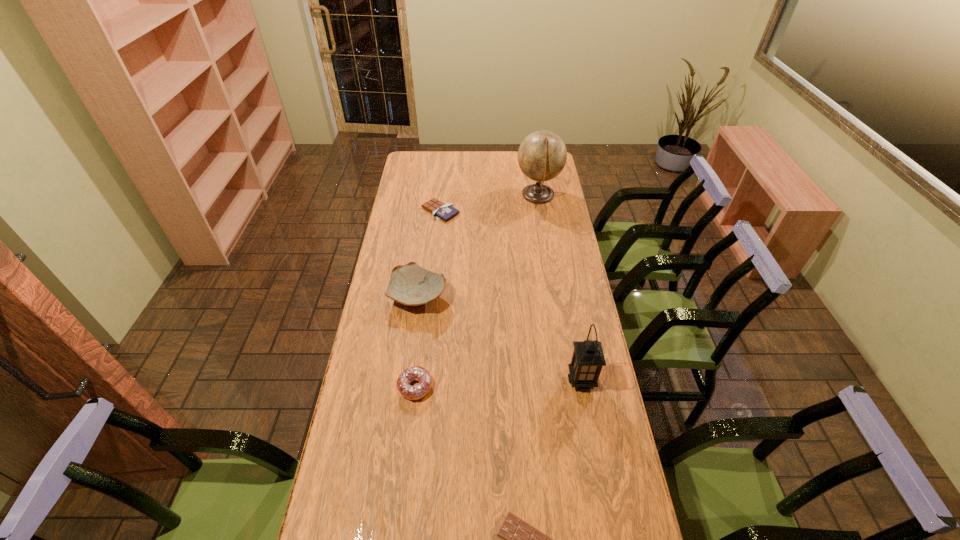
At what (x,y) coordinates should I click in order to perform the action: click on globe. Please return your answer as a coordinate pair (x, y). Image resolution: width=960 pixels, height=540 pixels. Looking at the image, I should click on (542, 155).

The height and width of the screenshot is (540, 960). In order to click on the second tallest object in this screenshot , I will do `click(588, 358)`.

Image resolution: width=960 pixels, height=540 pixels. I want to click on pottery, so click(412, 285).

Find the location of a particular element. Image resolution: width=960 pixels, height=540 pixels. the fourth shortest object is located at coordinates (412, 285).

The height and width of the screenshot is (540, 960). In order to click on doughnut in this screenshot , I will do `click(418, 373)`.

In order to click on the farther chocolate bar in this screenshot , I will do `click(440, 210)`.

The width and height of the screenshot is (960, 540). What are the coordinates of `the second shortest object` in the screenshot? It's located at (440, 210).

Where is `free region located 0.250m on the front-facing side of the tallest object`? The image size is (960, 540). free region located 0.250m on the front-facing side of the tallest object is located at coordinates (465, 195).

Find the location of a particular element. free spot located 0.260m on the front-facing side of the tallest object is located at coordinates tap(463, 195).

Locate an element on the screen. This screenshot has width=960, height=540. vacant space located 0.350m on the front-facing side of the tallest object is located at coordinates (444, 195).